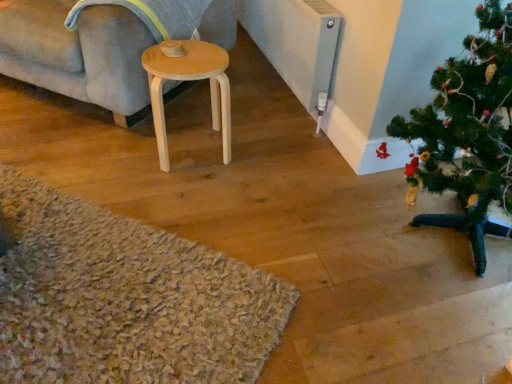
Question: Is the position of textured gray radiator at center right less distant than that of light wood stool at center?

Choices:
 (A) yes
 (B) no

Answer: (B)

Question: Can you confirm if textured gray radiator at center right is thinner than light wood stool at center?

Choices:
 (A) yes
 (B) no

Answer: (A)

Question: Does textured gray radiator at center right contain light wood stool at center?

Choices:
 (A) yes
 (B) no

Answer: (B)

Question: Is textured gray radiator at center right wider than light wood stool at center?

Choices:
 (A) yes
 (B) no

Answer: (B)

Question: Is textured gray radiator at center right completely or partially outside of light wood stool at center?

Choices:
 (A) yes
 (B) no

Answer: (A)

Question: Would you say textured gray radiator at center right is to the left or to the right of light wood stool at center in the picture?

Choices:
 (A) left
 (B) right

Answer: (B)

Question: In the image, is textured gray radiator at center right positioned in front of or behind light wood stool at center?

Choices:
 (A) behind
 (B) front

Answer: (A)

Question: From a real-world perspective, is textured gray radiator at center right above or below light wood stool at center?

Choices:
 (A) below
 (B) above

Answer: (B)

Question: Is textured gray radiator at center right inside the boundaries of light wood stool at center, or outside?

Choices:
 (A) outside
 (B) inside

Answer: (A)

Question: Is point (471, 74) closer or farther from the camera than point (290, 87)?

Choices:
 (A) farther
 (B) closer

Answer: (B)

Question: From a real-world perspective, is green matte christmas tree at lower right physically located above or below textured gray radiator at center right?

Choices:
 (A) above
 (B) below

Answer: (A)

Question: From the image's perspective, is green matte christmas tree at lower right above or below textured gray radiator at center right?

Choices:
 (A) above
 (B) below

Answer: (B)

Question: In terms of width, does green matte christmas tree at lower right look wider or thinner when compared to textured gray radiator at center right?

Choices:
 (A) thin
 (B) wide

Answer: (B)

Question: In the image, is light wood stool at center on the left side or the right side of light gray fabric couch at upper left?

Choices:
 (A) left
 (B) right

Answer: (B)

Question: Relative to light gray fabric couch at upper left, is light wood stool at center in front or behind?

Choices:
 (A) behind
 (B) front

Answer: (A)